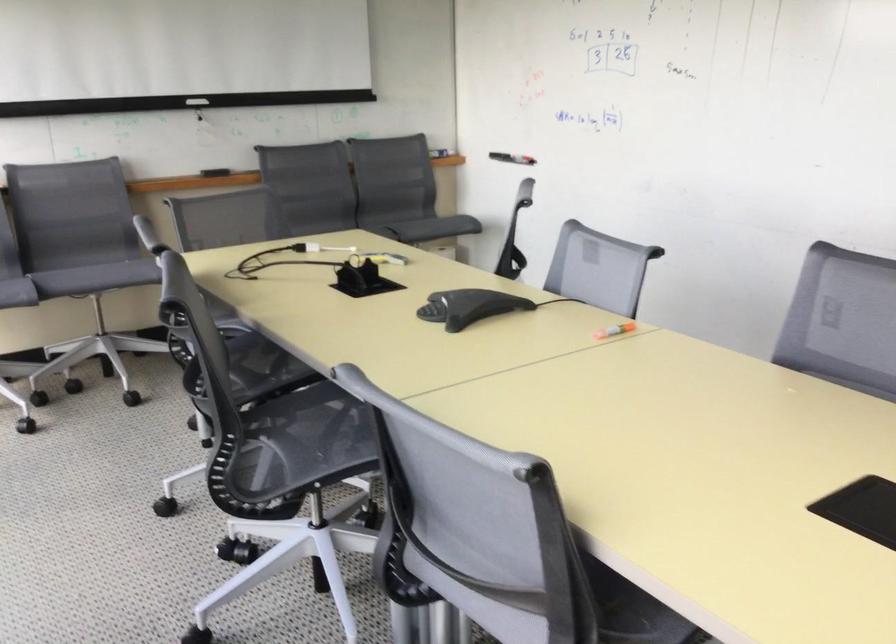
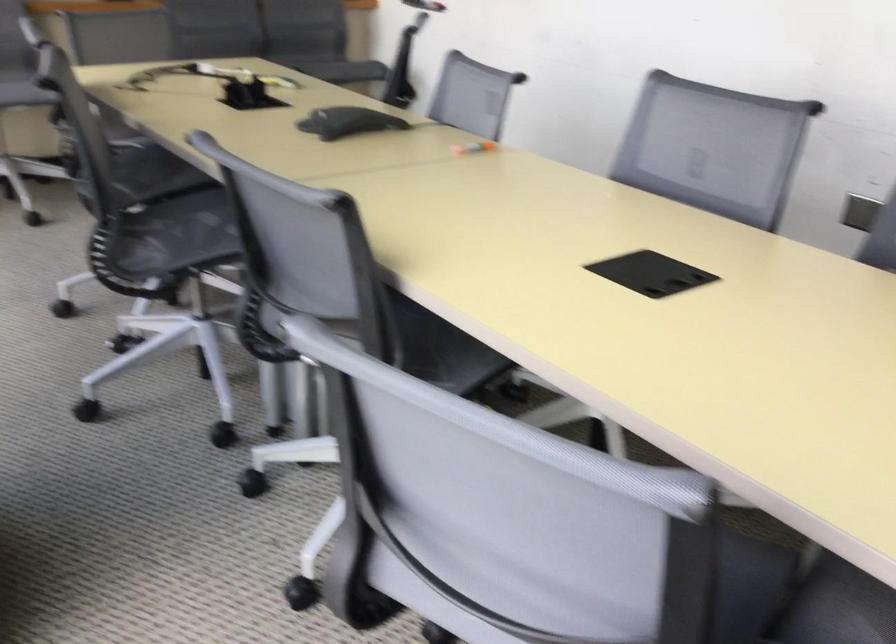
The point at (x=471, y=308) is marked in the first image. Where is the corresponding point in the second image?

(348, 122)